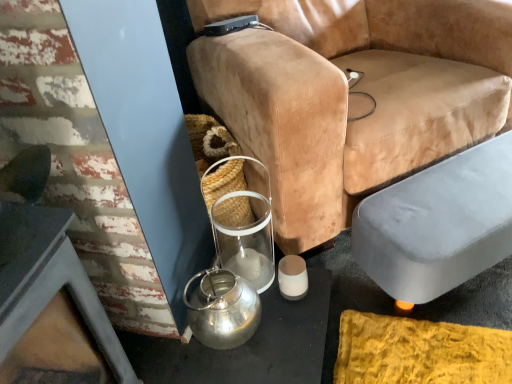
What are the coordinates of `empty space that is ontop of shiny metallic kettle at lower left (from a real-world perspective)` in the screenshot? It's located at (216, 293).